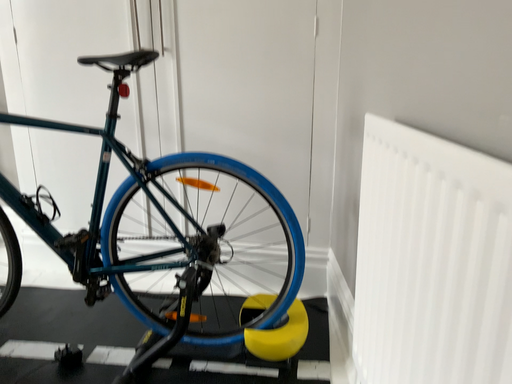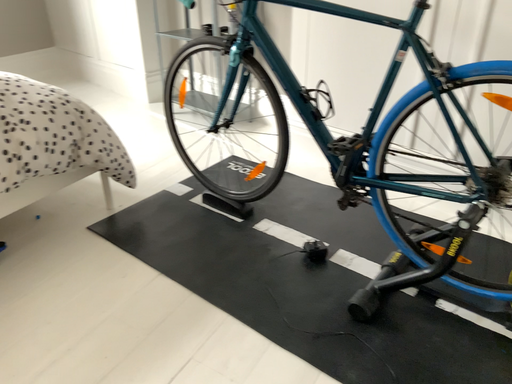
Question: Which way did the camera rotate in the video?

Choices:
 (A) rotated downward
 (B) rotated upward

Answer: (A)